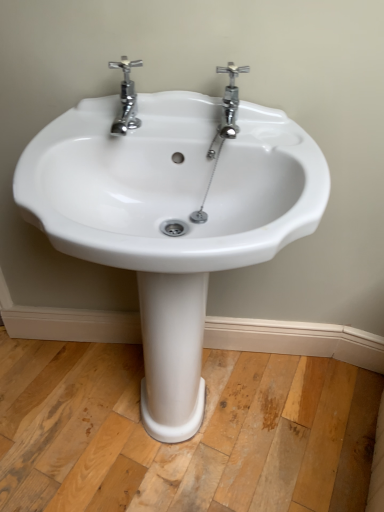
The image size is (384, 512). Identify the location of free point below white ceramic sink at center (from a real-world perspective). (190, 422).